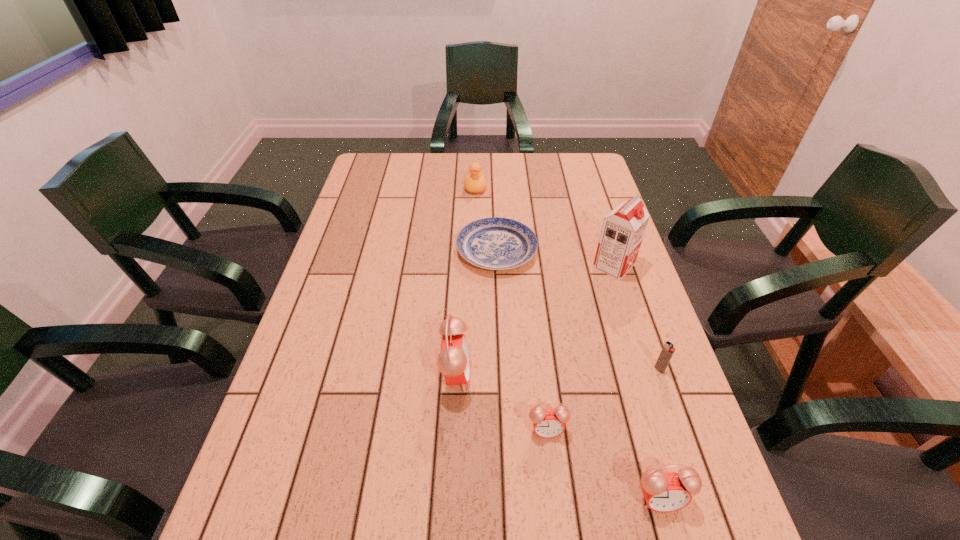
At what (x,y) coordinates should I click in order to perform the action: click on igniter that is at the right edge. Please return your answer as a coordinate pair (x, y). This screenshot has height=540, width=960. Looking at the image, I should click on (668, 350).

You are a GUI agent. You are given a task and a screenshot of the screen. Output one action in this format:
    pyautogui.click(x=<x>, y=<y>)
    Task: Click on the object at the near right corner
    
    Given the screenshot: What is the action you would take?
    pyautogui.click(x=664, y=492)

Image resolution: width=960 pixels, height=540 pixels. What are the coordinates of `free region at the far edge` in the screenshot? It's located at (516, 155).

Where is `free spot at the near edge of the desktop`? The width and height of the screenshot is (960, 540). free spot at the near edge of the desktop is located at coordinates (386, 468).

Find the location of a particular element. The height and width of the screenshot is (540, 960). free spot at the left edge of the desktop is located at coordinates (345, 258).

At what (x,y) coordinates should I click in order to perform the action: click on vacant area at the right edge. Please return your answer as a coordinate pair (x, y). Image resolution: width=960 pixels, height=540 pixels. Looking at the image, I should click on (626, 431).

The height and width of the screenshot is (540, 960). In order to click on vacant space at the near left corner in this screenshot , I will do `click(270, 476)`.

Where is `free spot at the far right corner of the desktop`? free spot at the far right corner of the desktop is located at coordinates (583, 178).

The image size is (960, 540). What are the coordinates of `vacant area that lies between the igniter and the third tallest object` in the screenshot? It's located at (660, 435).

Find the location of a particular element. blank region between the igniter and the tallest object is located at coordinates (636, 318).